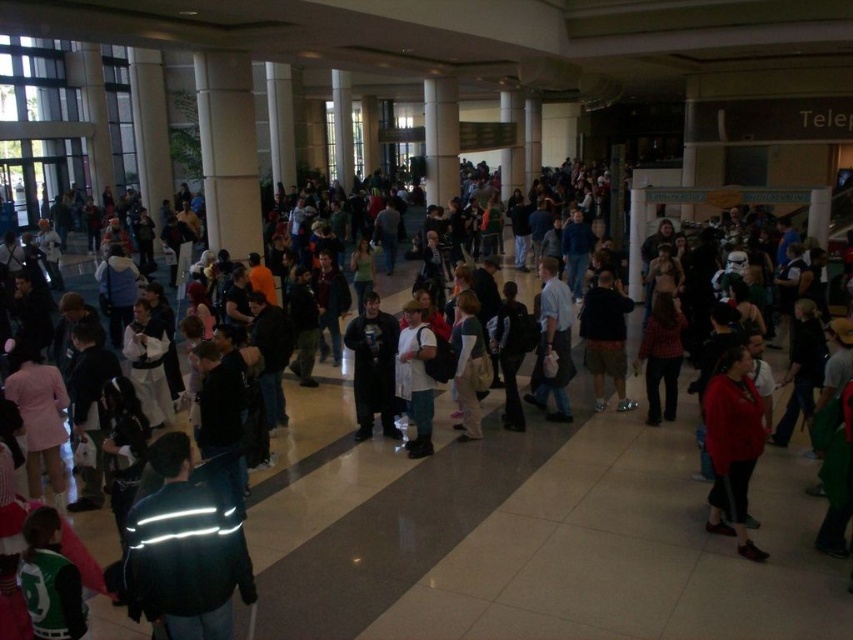
You are organizing a photo shoot and need to ensure that two models wearing the matte black jacket at center and the light blue shirt at center can stand side by side without overlapping. Based on their widths, do you think they can fit next to each other comfortably?

The matte black jacket at center might be wider than light blue shirt at center, so there is uncertainty about whether they can fit comfortably side by side without overlapping. Further measurement or testing is recommended.